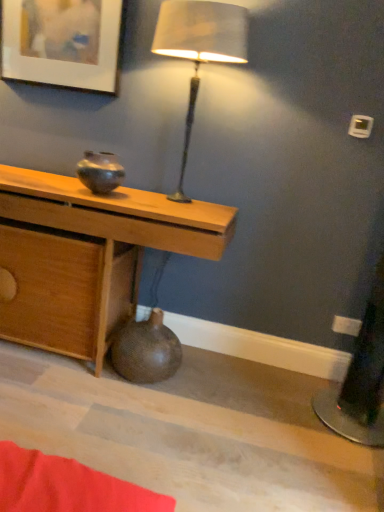
Question: Is brown textured vase at lower center, placed as the first vase when sorted from bottom to top, smaller than shiny metallic vase at center, placed as the first vase when sorted from top to bottom?

Choices:
 (A) yes
 (B) no

Answer: (B)

Question: Does brown textured vase at lower center, which is counted as the second vase, starting from the top, lie behind shiny metallic vase at center, the second vase when ordered from bottom to top?

Choices:
 (A) no
 (B) yes

Answer: (B)

Question: Can you confirm if brown textured vase at lower center, which is counted as the second vase, starting from the top, is positioned to the right of shiny metallic vase at center, placed as the first vase when sorted from top to bottom?

Choices:
 (A) yes
 (B) no

Answer: (A)

Question: Is brown textured vase at lower center, placed as the first vase when sorted from bottom to top, to the left of shiny metallic vase at center, placed as the first vase when sorted from top to bottom, from the viewer's perspective?

Choices:
 (A) no
 (B) yes

Answer: (A)

Question: From the image's perspective, would you say brown textured vase at lower center, which is counted as the second vase, starting from the top, is positioned over shiny metallic vase at center, placed as the first vase when sorted from top to bottom?

Choices:
 (A) yes
 (B) no

Answer: (B)

Question: Would you consider brown textured vase at lower center, which is counted as the second vase, starting from the top, to be distant from shiny metallic vase at center, placed as the first vase when sorted from top to bottom?

Choices:
 (A) no
 (B) yes

Answer: (A)

Question: From the image's perspective, is wooden desk at center below brown textured vase at lower center, which is counted as the second vase, starting from the top?

Choices:
 (A) no
 (B) yes

Answer: (A)

Question: Considering the relative sizes of wooden desk at center and brown textured vase at lower center, placed as the first vase when sorted from bottom to top, in the image provided, is wooden desk at center wider than brown textured vase at lower center, placed as the first vase when sorted from bottom to top,?

Choices:
 (A) yes
 (B) no

Answer: (A)

Question: From a real-world perspective, is wooden desk at center positioned under brown textured vase at lower center, placed as the first vase when sorted from bottom to top, based on gravity?

Choices:
 (A) no
 (B) yes

Answer: (A)

Question: From a real-world perspective, is wooden desk at center on brown textured vase at lower center, placed as the first vase when sorted from bottom to top?

Choices:
 (A) yes
 (B) no

Answer: (A)

Question: Is wooden desk at center facing away from brown textured vase at lower center, placed as the first vase when sorted from bottom to top?

Choices:
 (A) yes
 (B) no

Answer: (A)

Question: From the image's perspective, does wooden desk at center appear higher than brown textured vase at lower center, which is counted as the second vase, starting from the top?

Choices:
 (A) no
 (B) yes

Answer: (B)

Question: Is brown textured vase at lower center, which is counted as the second vase, starting from the top, to the right of wooden desk at center from the viewer's perspective?

Choices:
 (A) yes
 (B) no

Answer: (A)